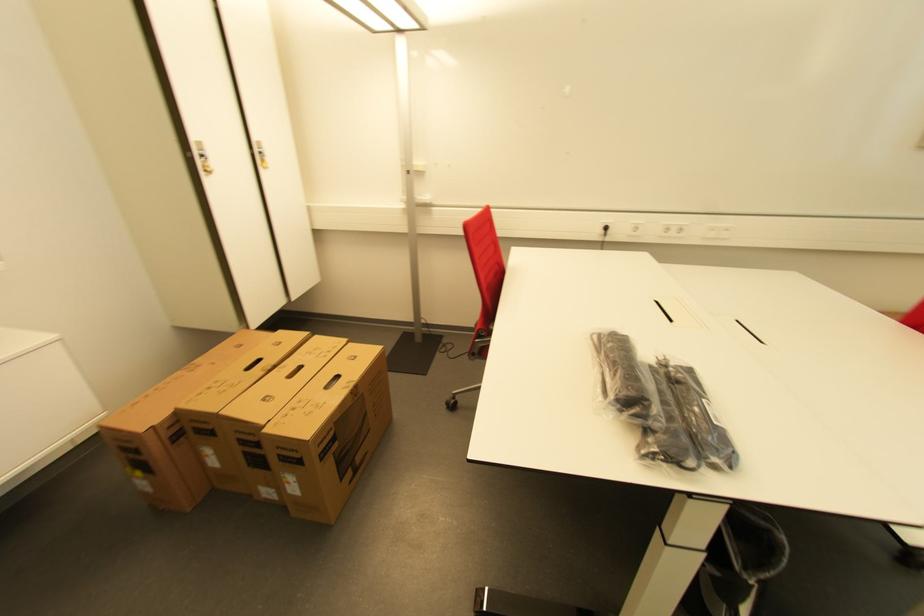
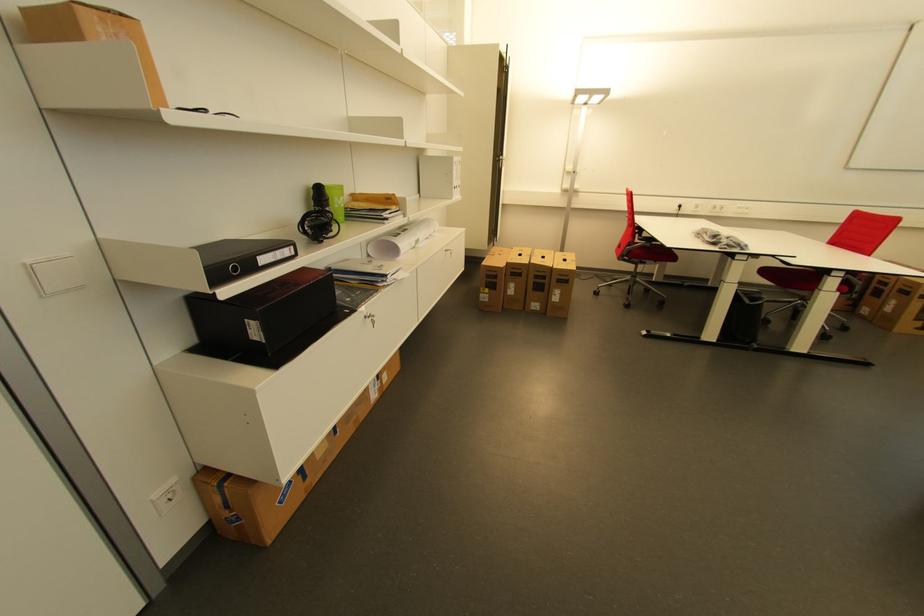
Where in the second image is the point corresponding to the point at 481,352 from the first image?

(629, 254)